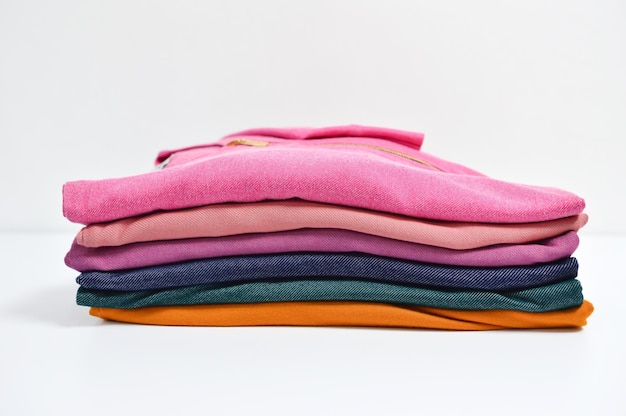
Image resolution: width=626 pixels, height=416 pixels. I want to click on folded clothes, so click(316, 175), click(309, 210), click(309, 235), click(313, 262), click(310, 286), click(310, 311).